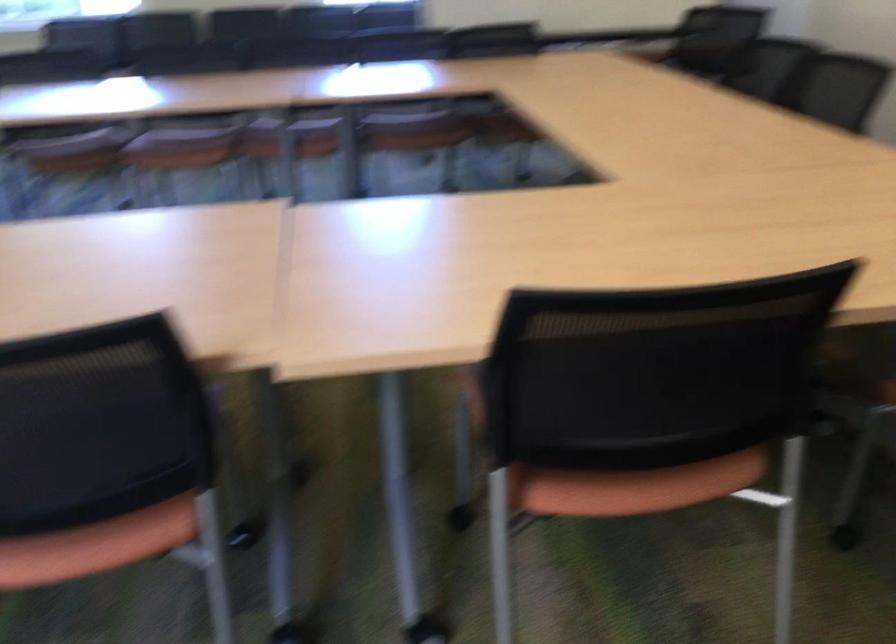
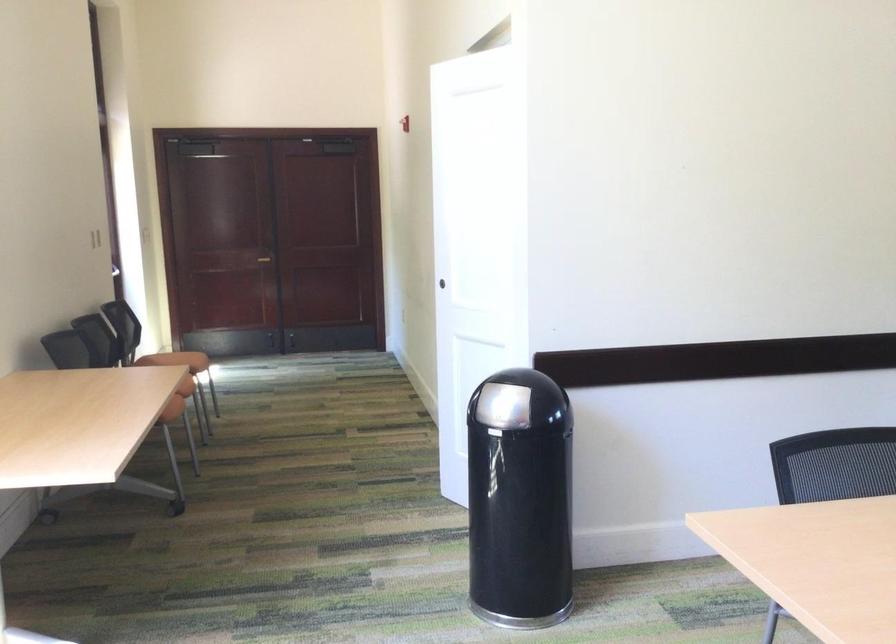
Question: Based on the continuous images, in which direction is the camera rotating? Reply with the corresponding letter.

Choices:
 (A) Left
 (B) Right
 (C) Up
 (D) Down

Answer: (A)